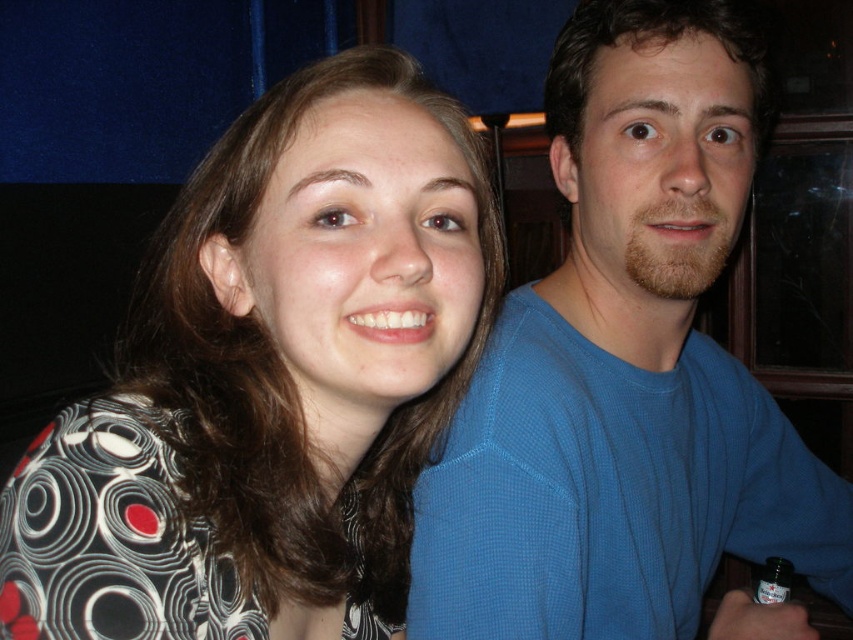
Which of these two, patterned fabric shirt at center or blue textured shirt at upper right, stands taller?

Standing taller between the two is blue textured shirt at upper right.

Which is in front, point (415, 372) or point (496, 628)?

Point (415, 372)

I want to click on patterned fabric shirt at center, so click(x=271, y=380).